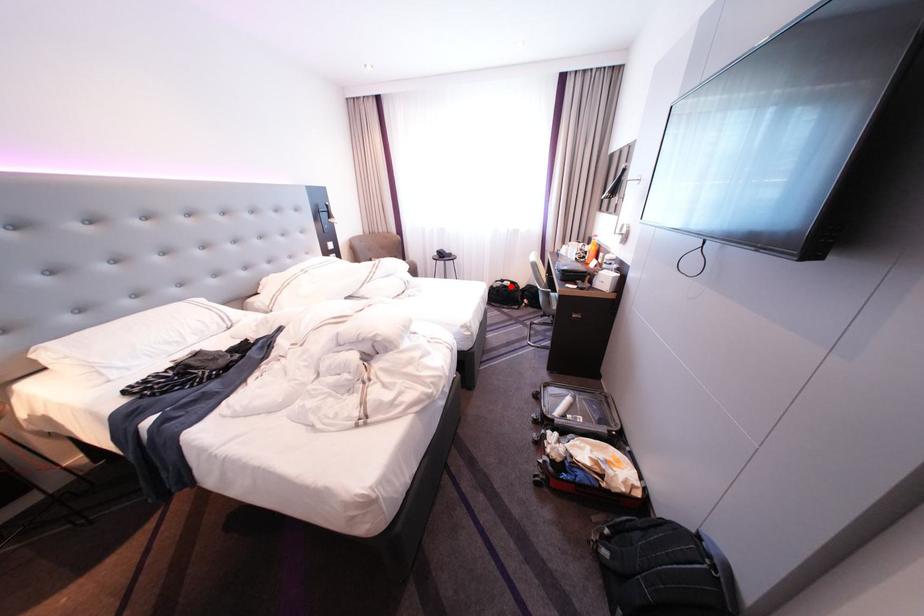
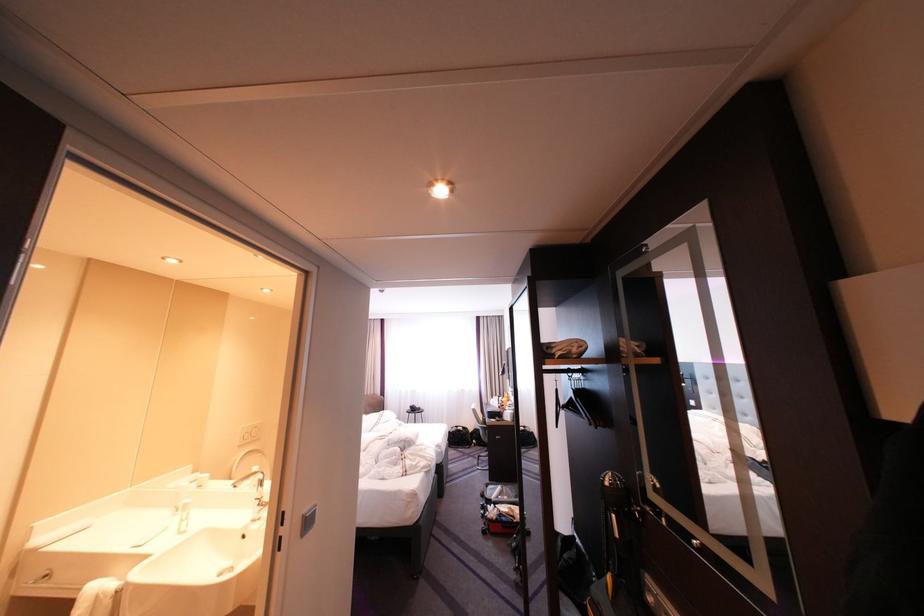
Question: I am providing you with two images of the same scene from different viewpoints. Given a red point in image1, look at the same physical point in image2. Is it:

Choices:
 (A) Closer to the viewpoint
 (B) Farther from the viewpoint

Answer: (B)